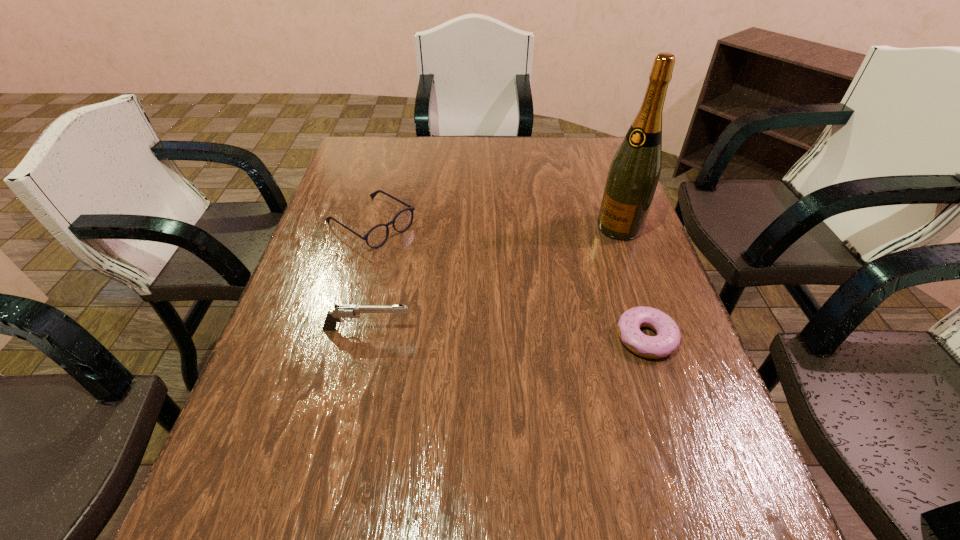
Where is `free region located 0.160m on the front-facing side of the tallest object`? This screenshot has height=540, width=960. free region located 0.160m on the front-facing side of the tallest object is located at coordinates (572, 266).

Identify the location of free space located on the front-facing side of the tallest object. (514, 316).

The image size is (960, 540). In order to click on pistol that is at the left edge in this screenshot , I will do `click(341, 311)`.

Locate an element on the screen. Image resolution: width=960 pixels, height=540 pixels. spectacles that is positioned at the left edge is located at coordinates (377, 236).

What are the coordinates of `doughnut that is at the right edge` in the screenshot? It's located at (668, 337).

Image resolution: width=960 pixels, height=540 pixels. Find the location of `wine bottle that is at the right edge`. wine bottle that is at the right edge is located at coordinates (632, 179).

The height and width of the screenshot is (540, 960). Identify the location of vacant area at the far edge. (501, 141).

The height and width of the screenshot is (540, 960). Find the location of `free region at the left edge of the desktop`. free region at the left edge of the desktop is located at coordinates (347, 249).

The height and width of the screenshot is (540, 960). I want to click on vacant region at the right edge of the desktop, so click(x=600, y=189).

This screenshot has width=960, height=540. In the image, there is a desktop. What are the coordinates of `vacant space at the far left corner` in the screenshot? It's located at (351, 153).